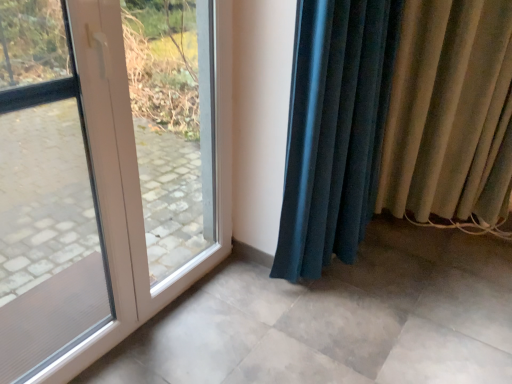
Question: Can you confirm if beige fabric curtain at right, arranged as the second curtain when viewed from the left, is taller than velvet teal curtain at lower right, acting as the first curtain starting from the left?

Choices:
 (A) yes
 (B) no

Answer: (B)

Question: From the image's perspective, would you say beige fabric curtain at right, arranged as the second curtain when viewed from the left, is shown under velvet teal curtain at lower right, placed as the second curtain when sorted from right to left?

Choices:
 (A) no
 (B) yes

Answer: (A)

Question: Is beige fabric curtain at right, positioned as the 1th curtain in right-to-left order, wider than velvet teal curtain at lower right, acting as the first curtain starting from the left?

Choices:
 (A) yes
 (B) no

Answer: (B)

Question: Is beige fabric curtain at right, arranged as the second curtain when viewed from the left, outside of velvet teal curtain at lower right, acting as the first curtain starting from the left?

Choices:
 (A) no
 (B) yes

Answer: (B)

Question: Is the position of beige fabric curtain at right, arranged as the second curtain when viewed from the left, more distant than that of velvet teal curtain at lower right, placed as the second curtain when sorted from right to left?

Choices:
 (A) yes
 (B) no

Answer: (A)

Question: From a real-world perspective, is velvet teal curtain at lower right, placed as the second curtain when sorted from right to left, above or below white plastic door at left?

Choices:
 (A) below
 (B) above

Answer: (B)

Question: Is velvet teal curtain at lower right, placed as the second curtain when sorted from right to left, to the left or to the right of white plastic door at left in the image?

Choices:
 (A) left
 (B) right

Answer: (B)

Question: Is velvet teal curtain at lower right, acting as the first curtain starting from the left, in front of or behind white plastic door at left in the image?

Choices:
 (A) front
 (B) behind

Answer: (B)

Question: From the image's perspective, is velvet teal curtain at lower right, acting as the first curtain starting from the left, above or below white plastic door at left?

Choices:
 (A) below
 (B) above

Answer: (B)

Question: In terms of height, does white plastic door at left look taller or shorter compared to beige fabric curtain at right, positioned as the 1th curtain in right-to-left order?

Choices:
 (A) tall
 (B) short

Answer: (A)

Question: Is white plastic door at left to the left or to the right of beige fabric curtain at right, positioned as the 1th curtain in right-to-left order, in the image?

Choices:
 (A) right
 (B) left

Answer: (B)

Question: From the image's perspective, is white plastic door at left positioned above or below beige fabric curtain at right, arranged as the second curtain when viewed from the left?

Choices:
 (A) above
 (B) below

Answer: (B)

Question: Relative to beige fabric curtain at right, positioned as the 1th curtain in right-to-left order, is white plastic door at left in front or behind?

Choices:
 (A) behind
 (B) front

Answer: (B)

Question: From a real-world perspective, is beige fabric curtain at right, arranged as the second curtain when viewed from the left, physically located above or below velvet teal curtain at lower right, placed as the second curtain when sorted from right to left?

Choices:
 (A) above
 (B) below

Answer: (A)

Question: Considering the positions of beige fabric curtain at right, arranged as the second curtain when viewed from the left, and velvet teal curtain at lower right, acting as the first curtain starting from the left, in the image, is beige fabric curtain at right, arranged as the second curtain when viewed from the left, taller or shorter than velvet teal curtain at lower right, acting as the first curtain starting from the left,?

Choices:
 (A) short
 (B) tall

Answer: (A)